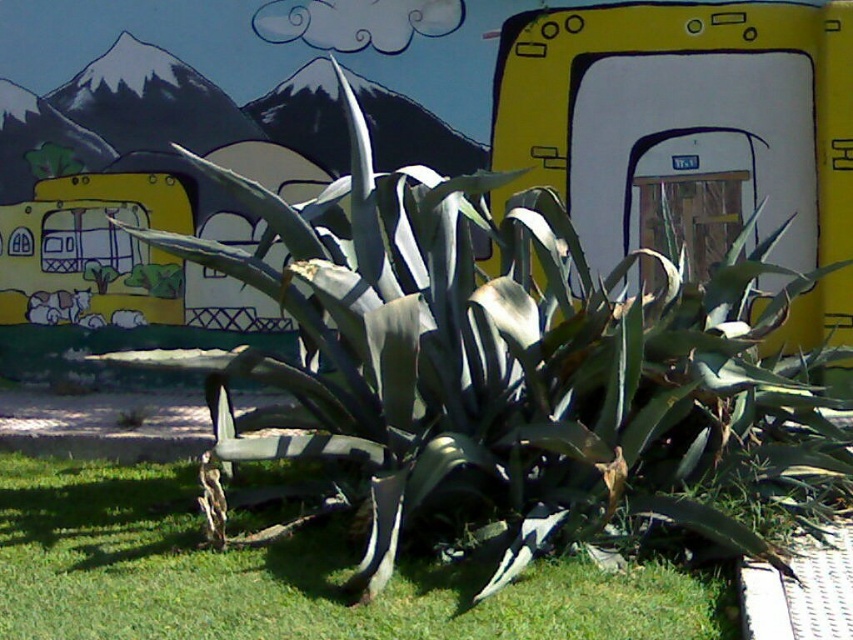
In the scene shown: Between green grass at lower center and yellow matte school bus at left, which one appears on the left side from the viewer's perspective?

Positioned to the left is yellow matte school bus at left.

Is green grass at lower center behind yellow matte school bus at left?

No, it is not.

Image resolution: width=853 pixels, height=640 pixels. What do you see at coordinates (282, 576) in the screenshot? I see `green grass at lower center` at bounding box center [282, 576].

What are the coordinates of `green grass at lower center` in the screenshot? It's located at click(x=282, y=576).